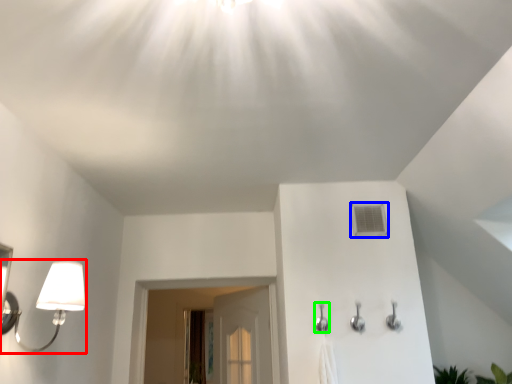
Question: Based on their relative distances, which object is farther from lamp (highlighted by a red box)? Choose from air conditioner (highlighted by a blue box) and shower (highlighted by a green box).

Choices:
 (A) air conditioner
 (B) shower

Answer: (A)